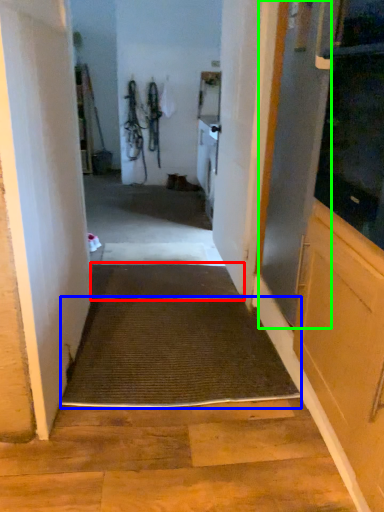
Question: Considering the real-world distances, which object is closest to doormat (highlighted by a red box)? doormat (highlighted by a blue box) or screen door (highlighted by a green box).

Choices:
 (A) doormat
 (B) screen door

Answer: (A)